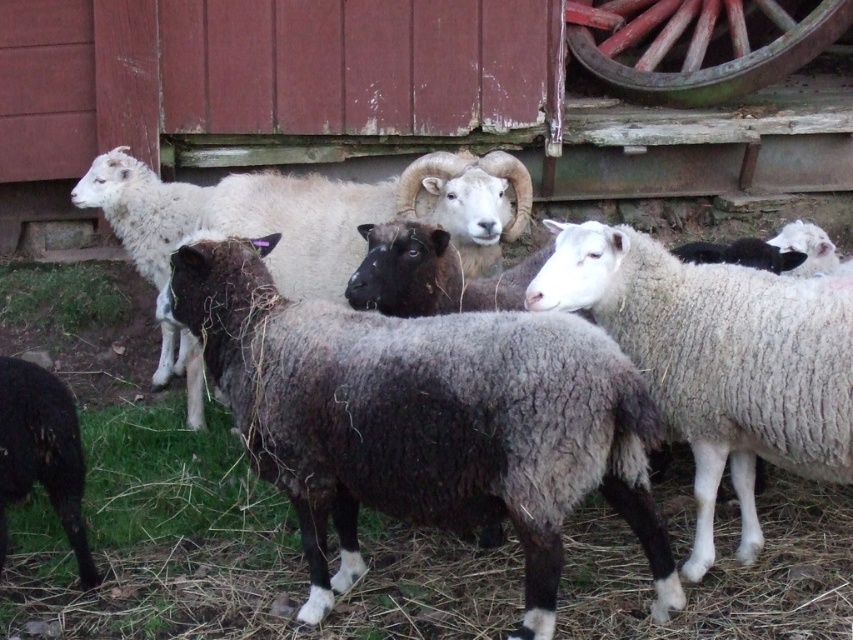
Consider the image. You are standing in the farm scene and want to move from the white woolly sheep at center to the rustic wood wagon wheel at upper right. Which direction should you move to reach it?

The white woolly sheep at center is located below the rustic wood wagon wheel at upper right, so you should move upward to reach it.

You are a farmer who needs to move a new fence post between the white woolly sheep at center and the green fuzzy grass at lower left. The fence post requires a space of 10 feet. Can you place it there?

The distance between the white woolly sheep at center and the green fuzzy grass at lower left is 9.82 feet, which is slightly less than the required 10 feet. Therefore, the fence post cannot be placed there as there isn